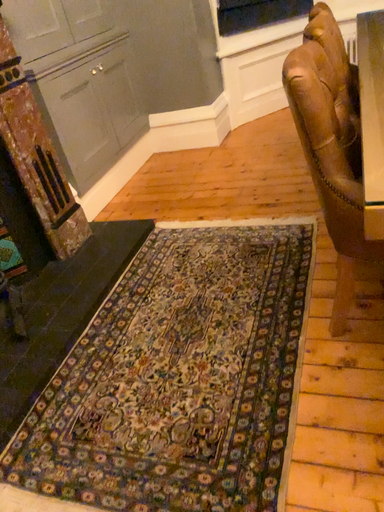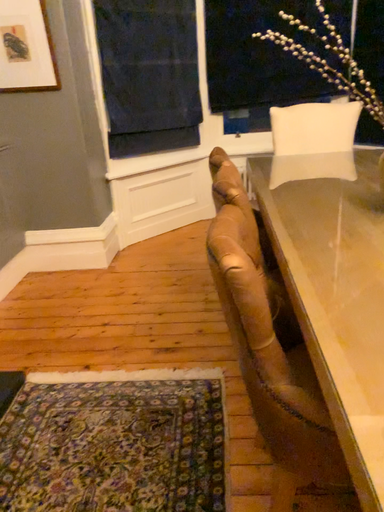
Question: How did the camera likely rotate when shooting the video?

Choices:
 (A) rotated upward
 (B) rotated downward

Answer: (A)